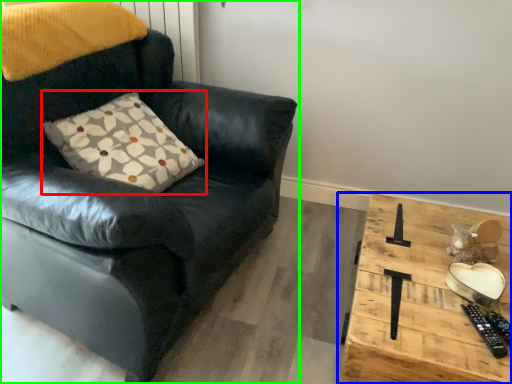
Question: Which object is the closest to the pillow (highlighted by a red box)? Choose among these: table (highlighted by a blue box) or chair (highlighted by a green box).

Choices:
 (A) table
 (B) chair

Answer: (B)